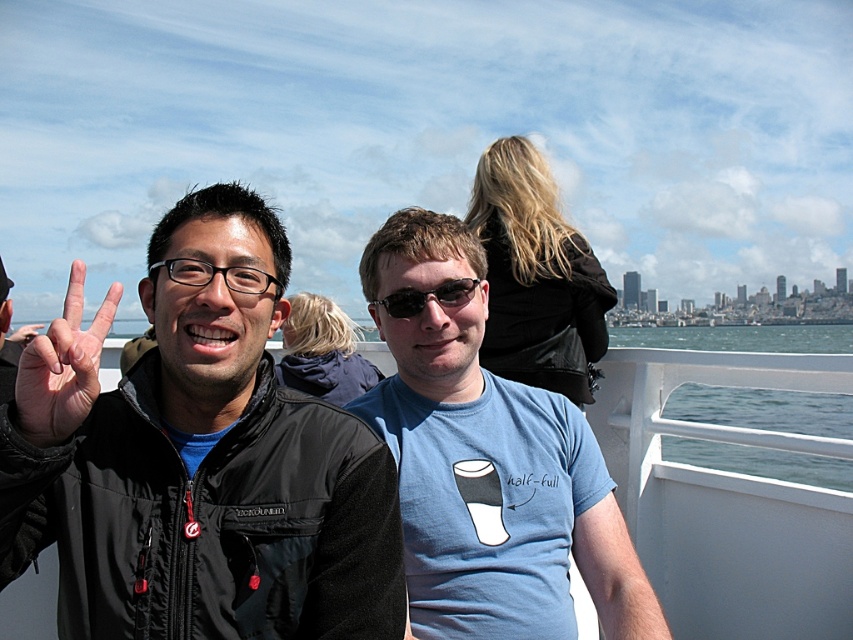
You are a photographer trying to capture the scene on the ferry. You notice the black matte jacket at left and the blue water at lower right. Which object should you focus on if you want to highlight something that takes up more visual space in the image?

The blue water at lower right should be focused on because it occupies more visual space than the black matte jacket at left, as stated in the description.

You are on a ferry and want to take a photo of the black matte jacket at left and the blue water at lower right. Can you see both in the same frame without moving your camera?

Yes, the black matte jacket at left is in front of the blue water at lower right, so both can be seen in the same frame without moving the camera.